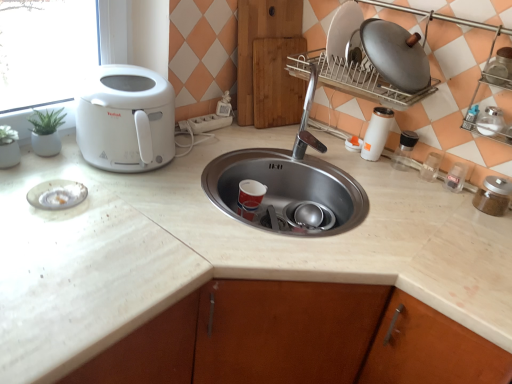
At what (x,y) coordinates should I click in order to perform the action: click on vacant space in front of clear glass bottle at right, the sixth appliance when ordered from right to left. Please return your answer as a coordinate pair (x, y). Image resolution: width=512 pixels, height=384 pixels. Looking at the image, I should click on click(x=407, y=185).